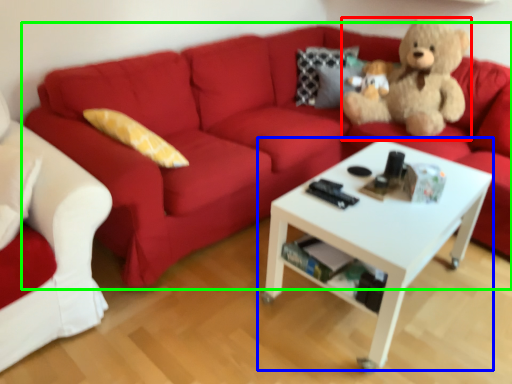
Question: Which object is the farthest from teddy bear (highlighted by a red box)? Choose among these: coffee table (highlighted by a blue box) or studio couch (highlighted by a green box).

Choices:
 (A) coffee table
 (B) studio couch

Answer: (A)